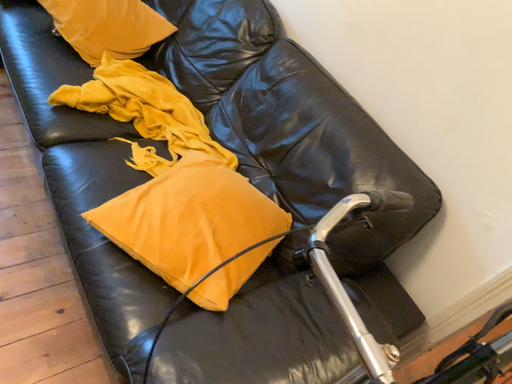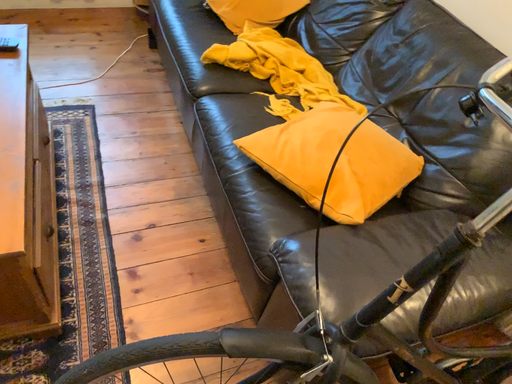
Question: Which way did the camera rotate in the video?

Choices:
 (A) rotated right
 (B) rotated left

Answer: (B)